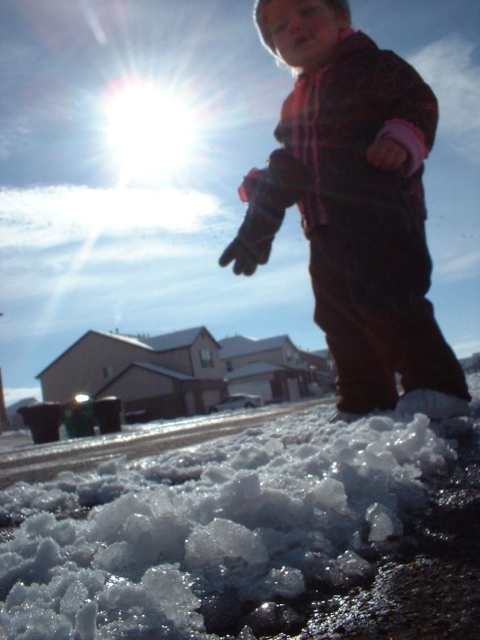
Question: Is white crystalline snow at lower center smaller than plaid fleece jacket at upper right?

Choices:
 (A) yes
 (B) no

Answer: (A)

Question: Is white crystalline snow at lower center below plaid fleece jacket at upper right?

Choices:
 (A) no
 (B) yes

Answer: (B)

Question: Can you confirm if white crystalline snow at lower center is positioned above plaid fleece jacket at upper right?

Choices:
 (A) yes
 (B) no

Answer: (B)

Question: Which point appears closest to the camera in this image?

Choices:
 (A) (397, 513)
 (B) (273, 220)

Answer: (A)

Question: Which point is farther to the camera?

Choices:
 (A) plaid fleece jacket at upper right
 (B) white crystalline snow at lower center

Answer: (A)